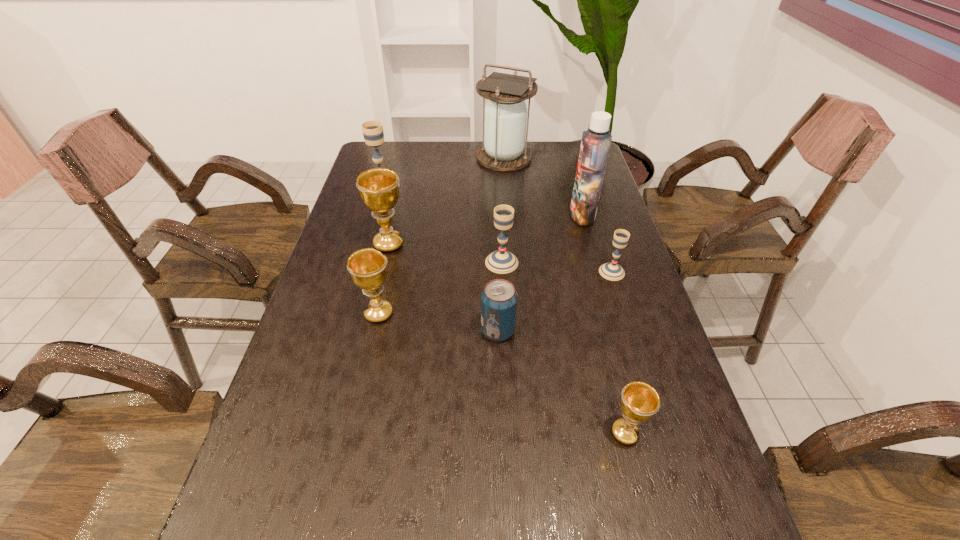
Where is `pop soda`? pop soda is located at coordinates (499, 298).

Image resolution: width=960 pixels, height=540 pixels. What are the coordinates of `the rightmost gray chalice` in the screenshot? It's located at (612, 271).

At what (x,y) coordinates should I click in order to perform the action: click on the rightmost chalice. Please return your answer as a coordinate pair (x, y). This screenshot has width=960, height=540. Looking at the image, I should click on (612, 271).

Image resolution: width=960 pixels, height=540 pixels. Identify the location of the smallest gold chalice. (639, 402).

I want to click on the ninth farthest object, so click(x=639, y=402).

At what (x,y) coordinates should I click in order to perform the action: click on vacant space located 0.170m on the left of the lantern. Please return your answer as a coordinate pair (x, y). The height and width of the screenshot is (540, 960). Looking at the image, I should click on (431, 158).

At what (x,y) coordinates should I click in order to perform the action: click on free space located on the front label of the shampoo. Please return your answer as a coordinate pair (x, y). The image size is (960, 540). Looking at the image, I should click on (541, 215).

Find the location of a particular element. blank area located on the front label of the shampoo is located at coordinates (554, 215).

Where is `free region located on the front label of the shampoo`? free region located on the front label of the shampoo is located at coordinates (548, 215).

You are a GUI agent. You are given a task and a screenshot of the screen. Output one action in this format:
    pyautogui.click(x=<x>, y=<y>)
    Task: Click on the free spot located 0.110m on the back of the farthest gold chalice
    Image resolution: width=960 pixels, height=540 pixels.
    Given the screenshot: What is the action you would take?
    pyautogui.click(x=396, y=211)